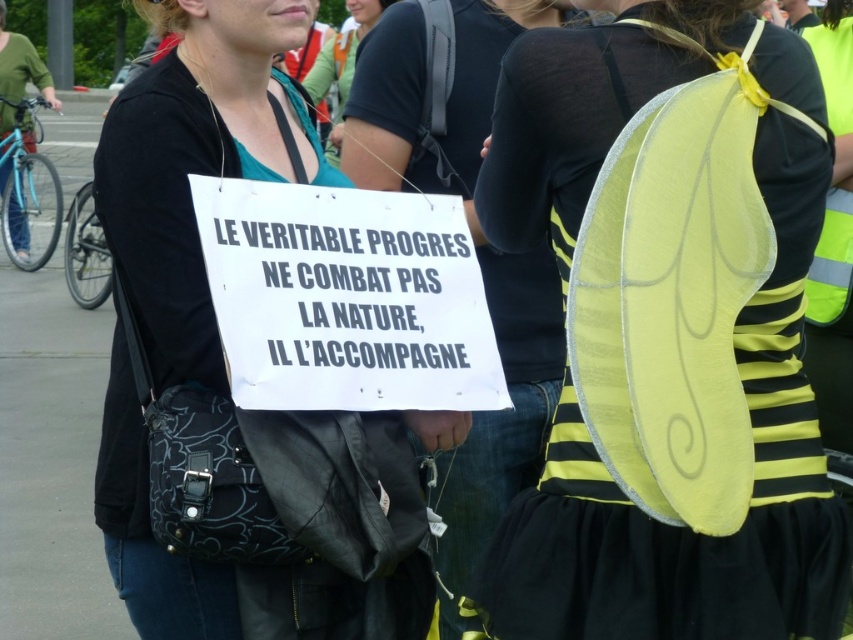
You are a photographer at the event and want to capture a photo where the yellow fabric wings at center are visible above the matte black shirt at upper center. Is this possible given their current positions?

The yellow fabric wings at center are currently positioned below the matte black shirt at upper center, so they cannot be seen above it in the current arrangement.

You are a photographer trying to capture both the yellow fabric wings at upper right and the matte black shirt at upper center in a single frame. Based on their sizes in the image, which object should you focus on to ensure both are clearly visible?

The yellow fabric wings at upper right occupies less space than matte black shirt at upper center, so focusing on the matte black shirt at upper center would allow both objects to be clearly visible in the frame.

You are a photographer at the event and want to capture both the yellow fabric wings at center and the matte black shirt at upper center in a single shot. Which object should you position closer to the left side of your camera frame to ensure both are visible?

To ensure both the yellow fabric wings at center and the matte black shirt at upper center are visible in the frame, position the matte black shirt at upper center closer to the left side of the camera frame since the yellow fabric wings at center is to the right of it.